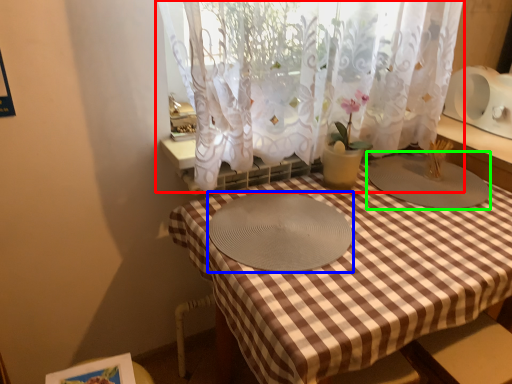
Question: Based on their relative distances, which object is nearer to curtain (highlighted by a red box)? Choose from glass plate (highlighted by a blue box) and glass plate (highlighted by a green box).

Choices:
 (A) glass plate
 (B) glass plate

Answer: (A)